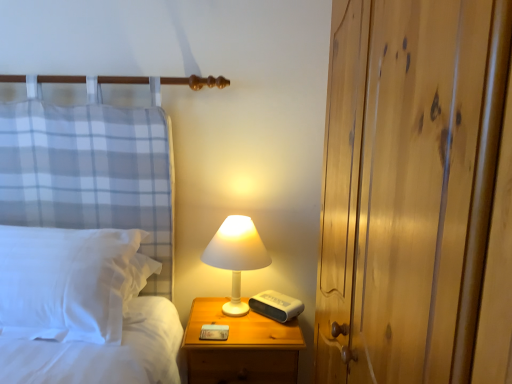
Question: Is white soft pillow at left outside of wooden nightstand at lower right?

Choices:
 (A) yes
 (B) no

Answer: (A)

Question: Is white soft pillow at left to the left of wooden nightstand at lower right from the viewer's perspective?

Choices:
 (A) yes
 (B) no

Answer: (A)

Question: Does white soft pillow at left contain wooden nightstand at lower right?

Choices:
 (A) no
 (B) yes

Answer: (A)

Question: Is white soft pillow at left turned away from wooden nightstand at lower right?

Choices:
 (A) no
 (B) yes

Answer: (A)

Question: Is white soft pillow at left shorter than wooden nightstand at lower right?

Choices:
 (A) yes
 (B) no

Answer: (A)

Question: From their relative heights in the image, would you say wooden nightstand at lower right is taller or shorter than white matte lamp at center?

Choices:
 (A) short
 (B) tall

Answer: (B)

Question: Looking at their shapes, would you say wooden nightstand at lower right is wider or thinner than white matte lamp at center?

Choices:
 (A) wide
 (B) thin

Answer: (A)

Question: Considering their positions, is wooden nightstand at lower right located in front of or behind white matte lamp at center?

Choices:
 (A) behind
 (B) front

Answer: (B)

Question: Is wooden nightstand at lower right bigger or smaller than white matte lamp at center?

Choices:
 (A) big
 (B) small

Answer: (A)

Question: From a real-world perspective, relative to wooden nightstand at lower right, is wooden dresser at right vertically above or below?

Choices:
 (A) above
 (B) below

Answer: (A)

Question: In terms of width, does wooden dresser at right look wider or thinner when compared to wooden nightstand at lower right?

Choices:
 (A) wide
 (B) thin

Answer: (B)

Question: Based on their sizes in the image, would you say wooden dresser at right is bigger or smaller than wooden nightstand at lower right?

Choices:
 (A) small
 (B) big

Answer: (B)

Question: Is point (485, 21) closer or farther from the camera than point (251, 347)?

Choices:
 (A) farther
 (B) closer

Answer: (B)

Question: Considering the positions of white soft pillow at left and wooden dresser at right in the image, is white soft pillow at left taller or shorter than wooden dresser at right?

Choices:
 (A) tall
 (B) short

Answer: (B)

Question: From a real-world perspective, is white soft pillow at left positioned above or below wooden dresser at right?

Choices:
 (A) below
 (B) above

Answer: (A)